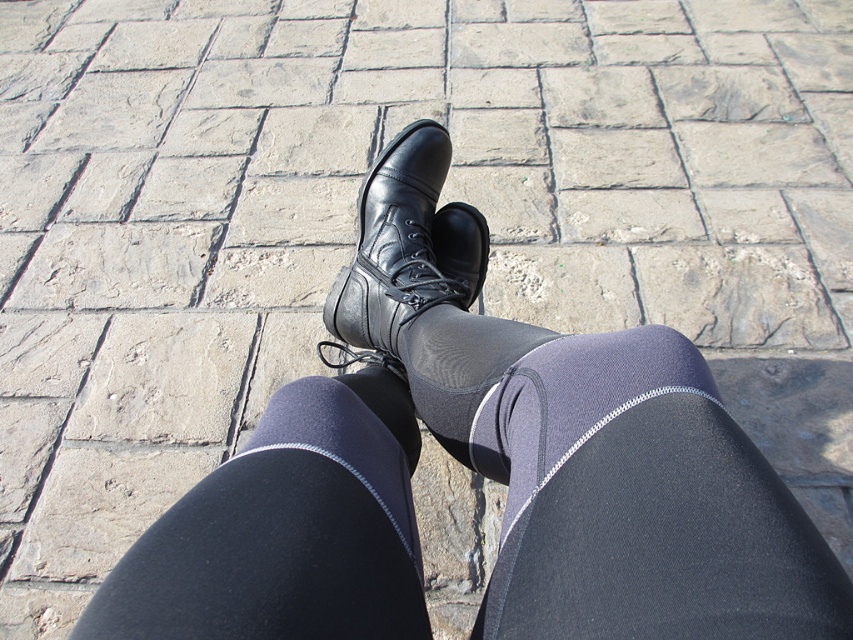
You are a fashion designer observing the image. You need to determine the layering order of the matte black leggings at center and the black matte sock at center. Which one is visible on top?

The matte black leggings at center is in front of the black matte sock at center, so the leggings are visible on top.

You are standing on the paved surface and want to place a marker exactly where the black leather shoe at center is located. According to the coordinates provided, what are the exact coordinates where you should place the marker?

The exact coordinates for placing the marker should be at point (404, 250), as this is the 2D location of the black leather shoe at center.